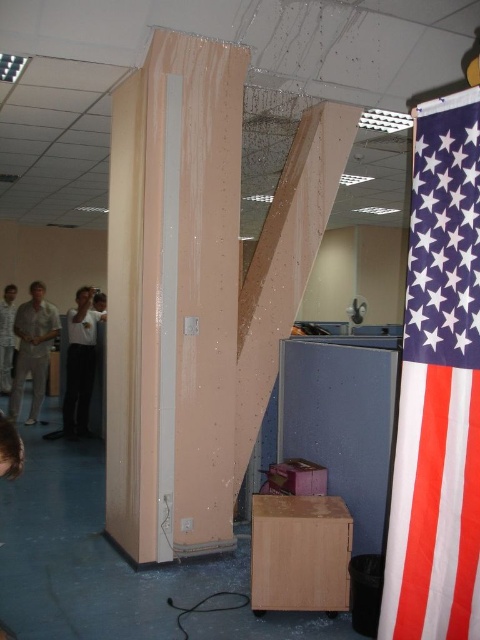
Which is above, matte beige shirt at left or white glossy shirt at center?

matte beige shirt at left

Where is `matte beige shirt at left`? Image resolution: width=480 pixels, height=640 pixels. matte beige shirt at left is located at coordinates (33, 349).

You are a GUI agent. You are given a task and a screenshot of the screen. Output one action in this format:
    pyautogui.click(x=<x>, y=<y>)
    Task: Click on the matte beige shirt at left
    The image size is (480, 640).
    Given the screenshot: What is the action you would take?
    pyautogui.click(x=33, y=349)

Which is more to the right, peach foamboard at center or white glossy shirt at center?

From the viewer's perspective, peach foamboard at center appears more on the right side.

Measure the distance between peach foamboard at center and camera.

peach foamboard at center is 3.13 meters away from camera.

This screenshot has width=480, height=640. I want to click on peach foamboard at center, so click(173, 300).

Who is positioned more to the right, peach foamboard at center or red-white-blue fabric flag at right?

From the viewer's perspective, red-white-blue fabric flag at right appears more on the right side.

Between peach foamboard at center and red-white-blue fabric flag at right, which one appears on the left side from the viewer's perspective?

peach foamboard at center is more to the left.

Between point (229, 460) and point (420, 440), which one is positioned behind?

The point (229, 460) is behind.

Locate an element on the screen. The image size is (480, 640). peach foamboard at center is located at coordinates (173, 300).